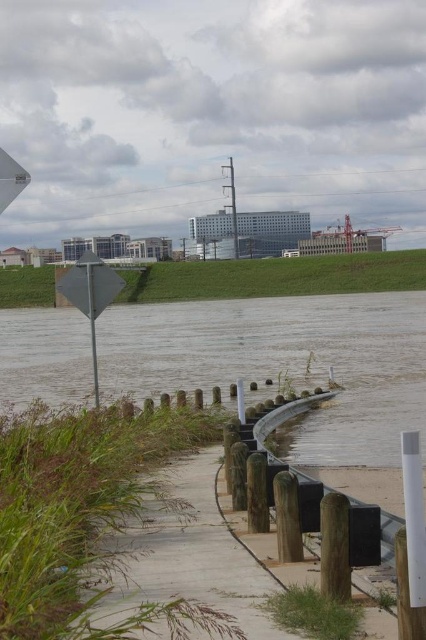
Question: Which of the following is the farthest from the observer?

Choices:
 (A) (94, 353)
 (B) (212, 321)
 (C) (91, 269)

Answer: (B)

Question: Which point is farther from the camera taking this photo?

Choices:
 (A) (198, 326)
 (B) (106, 266)

Answer: (A)

Question: Does metallic diamond-shaped sign at left have a greater width compared to metallic sign at left?

Choices:
 (A) no
 (B) yes

Answer: (B)

Question: Does brown/rough water at lower center have a greater width compared to metallic diamond-shaped sign at left?

Choices:
 (A) no
 (B) yes

Answer: (B)

Question: Which point is farther from the camera taking this photo?

Choices:
 (A) (54, 376)
 (B) (94, 310)

Answer: (A)

Question: Observing the image, what is the correct spatial positioning of metallic diamond-shaped sign at left in reference to metallic sign at left?

Choices:
 (A) right
 (B) left

Answer: (B)